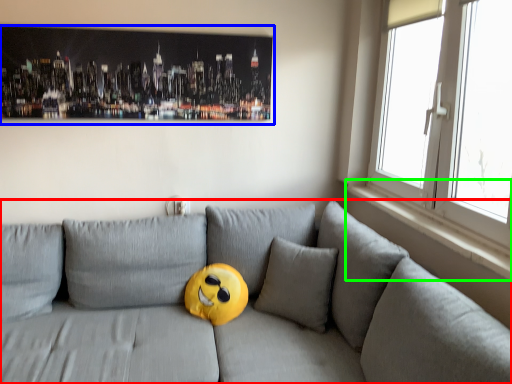
Question: Estimate the real-world distances between objects in this image. Which object is closer to studio couch (highlighted by a red box), picture frame (highlighted by a blue box) or window sill (highlighted by a green box)?

Choices:
 (A) picture frame
 (B) window sill

Answer: (B)